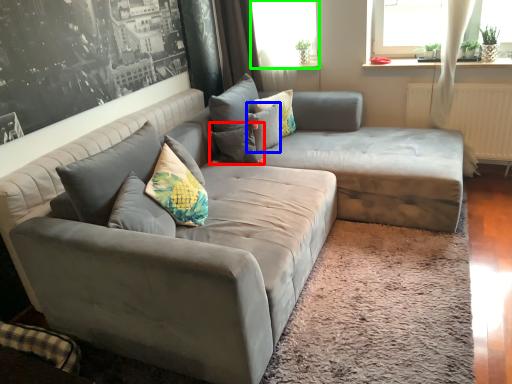
Question: Considering the real-world distances, which object is closest to pillow (highlighted by a red box)? pillow (highlighted by a blue box) or window screen (highlighted by a green box).

Choices:
 (A) pillow
 (B) window screen

Answer: (A)